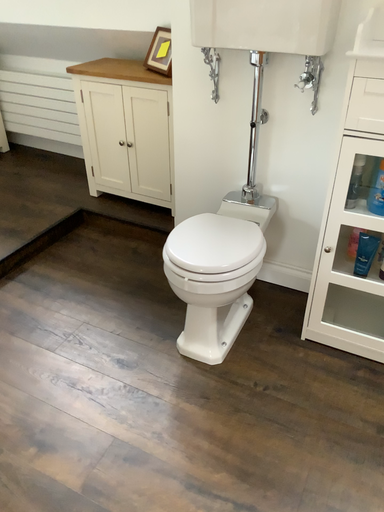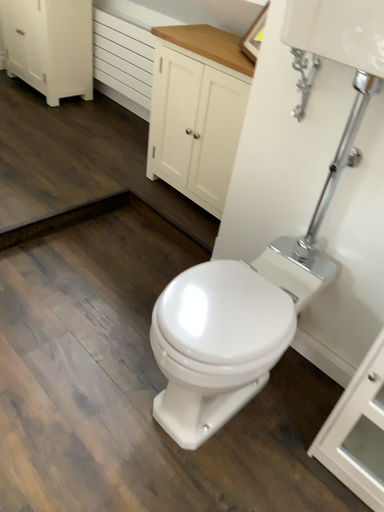
Question: Which way did the camera rotate in the video?

Choices:
 (A) rotated right
 (B) rotated left

Answer: (B)